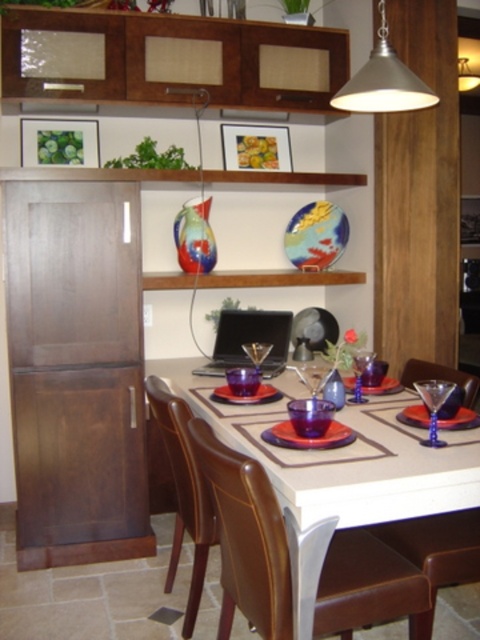
Question: Is transparent blue martini glass at table center in front of purple glass plate at center?

Choices:
 (A) yes
 (B) no

Answer: (A)

Question: Observing the image, what is the correct spatial positioning of brown leather chair at lower right in reference to purple glass plate at center?

Choices:
 (A) left
 (B) right

Answer: (B)

Question: Considering the real-world distances, which object is closest to the translucent purple plate at table center?

Choices:
 (A) purple glass plate at center
 (B) transparent glass wine glass at table center

Answer: (B)

Question: Which of the following is the closest to the observer?

Choices:
 (A) (200, 500)
 (B) (362, 369)
 (C) (257, 396)
 (D) (346, 388)

Answer: (A)

Question: Is white glossy table at center positioned before brown leather chair at center?

Choices:
 (A) yes
 (B) no

Answer: (A)

Question: Which object is positioned farthest from the transparent glass martini glass at table center?

Choices:
 (A) white glossy table at center
 (B) transparent blue wine glass at table center

Answer: (A)